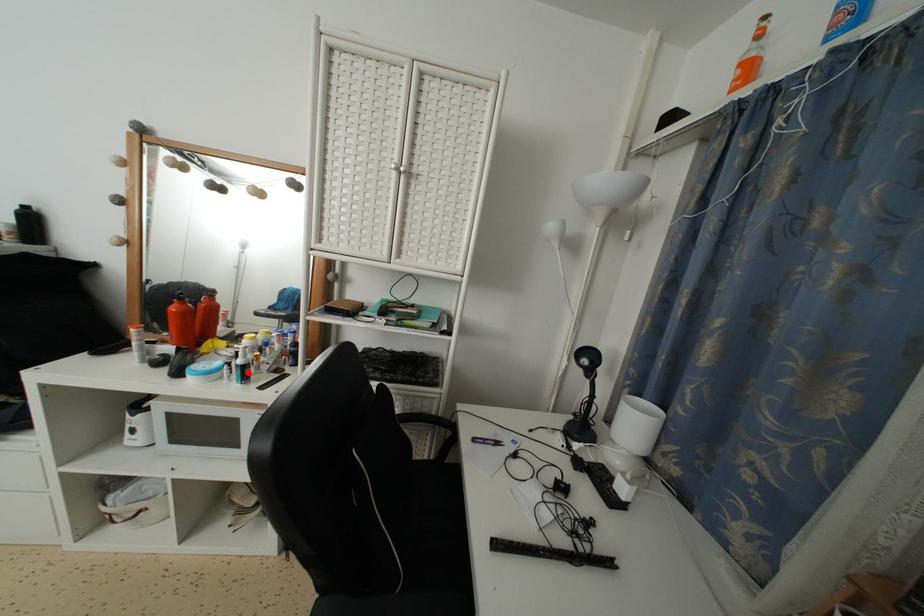
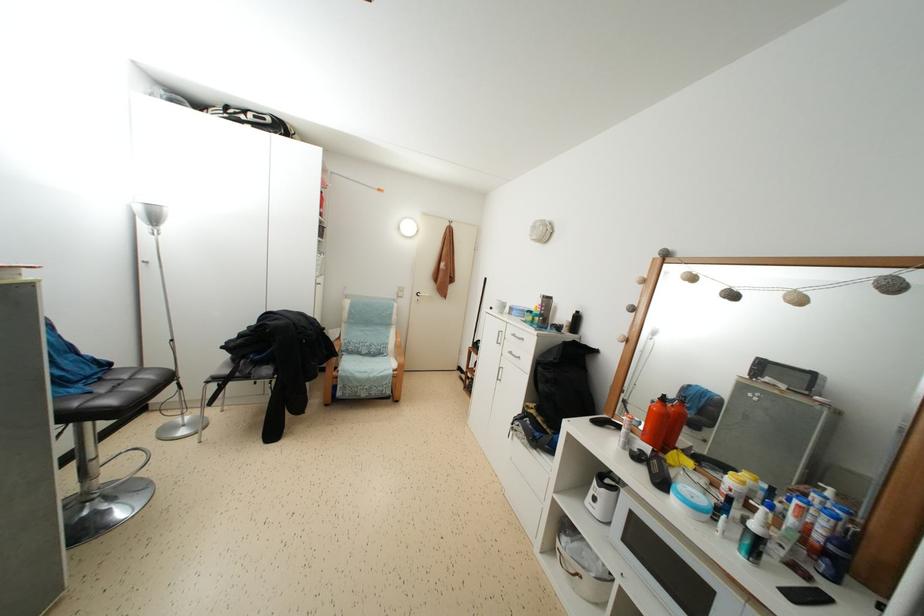
Question: I am providing you with two images of the same scene from different viewpoints. A red point is marked on the first image. Is the red point's position out of view in image 2?

Choices:
 (A) Yes
 (B) No

Answer: (B)